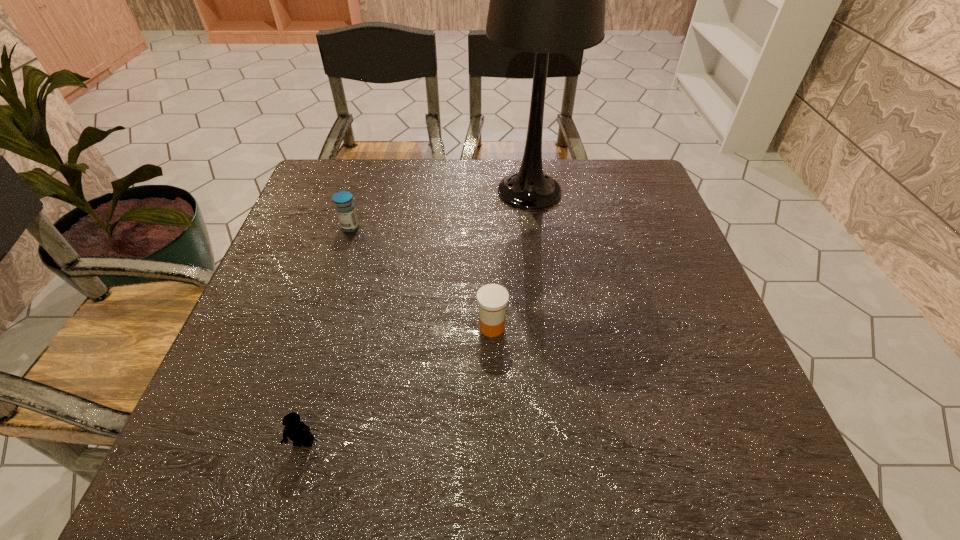
Locate an element on the screen. The image size is (960, 540). free location located on the label of the nearer medicine is located at coordinates (452, 327).

Locate an element on the screen. The height and width of the screenshot is (540, 960). blank area located 0.120m on the label of the nearer medicine is located at coordinates (418, 327).

Locate an element on the screen. The image size is (960, 540). vacant area located on the front of the third nearest object is located at coordinates (336, 273).

Where is `object that is at the far edge`? The image size is (960, 540). object that is at the far edge is located at coordinates (544, 0).

Where is `object that is at the near edge`? The height and width of the screenshot is (540, 960). object that is at the near edge is located at coordinates (296, 430).

The width and height of the screenshot is (960, 540). What are the coordinates of `object located in the left edge section of the desktop` in the screenshot? It's located at (345, 208).

You are a GUI agent. You are given a task and a screenshot of the screen. Output one action in this format:
    pyautogui.click(x=<x>, y=<y>)
    Task: Click on the vacant space at the far edge of the desktop
    The width and height of the screenshot is (960, 540).
    Given the screenshot: What is the action you would take?
    pyautogui.click(x=567, y=173)

In the image, there is a desktop. Where is `free space at the near edge`? This screenshot has width=960, height=540. free space at the near edge is located at coordinates (594, 451).

In the image, there is a desktop. Where is `vacant space at the left edge`? This screenshot has width=960, height=540. vacant space at the left edge is located at coordinates [237, 387].

In the image, there is a desktop. At what (x,y) coordinates should I click in order to perform the action: click on vacant space at the right edge. Please return your answer as a coordinate pair (x, y). This screenshot has width=960, height=540. Looking at the image, I should click on (671, 285).